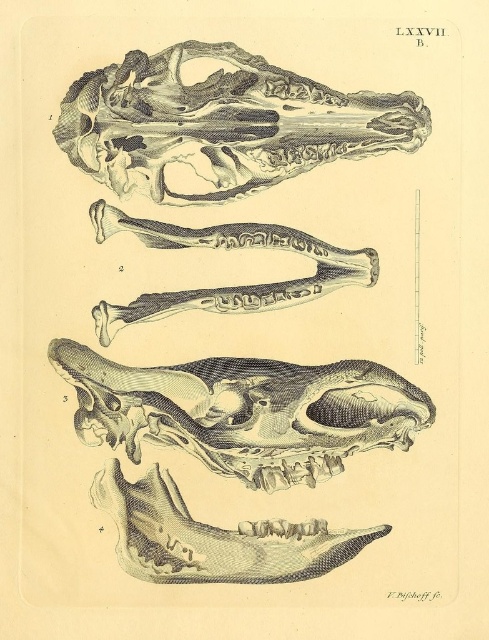
Question: Is etched bone skull at upper center thinner than gray etched skull at upper center?

Choices:
 (A) yes
 (B) no

Answer: (B)

Question: Which of these objects is positioned farthest from the etched bone skull at upper center?

Choices:
 (A) gray textured skull at center
 (B) gray etched skull at upper center

Answer: (B)

Question: Can you confirm if etched bone skull at upper center is positioned to the left of gray textured skull at center?

Choices:
 (A) no
 (B) yes

Answer: (A)

Question: Among these points, which one is farthest from the camera?

Choices:
 (A) (133, 176)
 (B) (336, 451)
 (C) (249, 481)

Answer: (B)

Question: Can you confirm if gray textured skull at center is positioned below gray etched skull at upper center?

Choices:
 (A) yes
 (B) no

Answer: (A)

Question: Which object is positioned closest to the gray etched skull at upper center?

Choices:
 (A) etched bone skull at upper center
 (B) gray textured skull at center

Answer: (A)